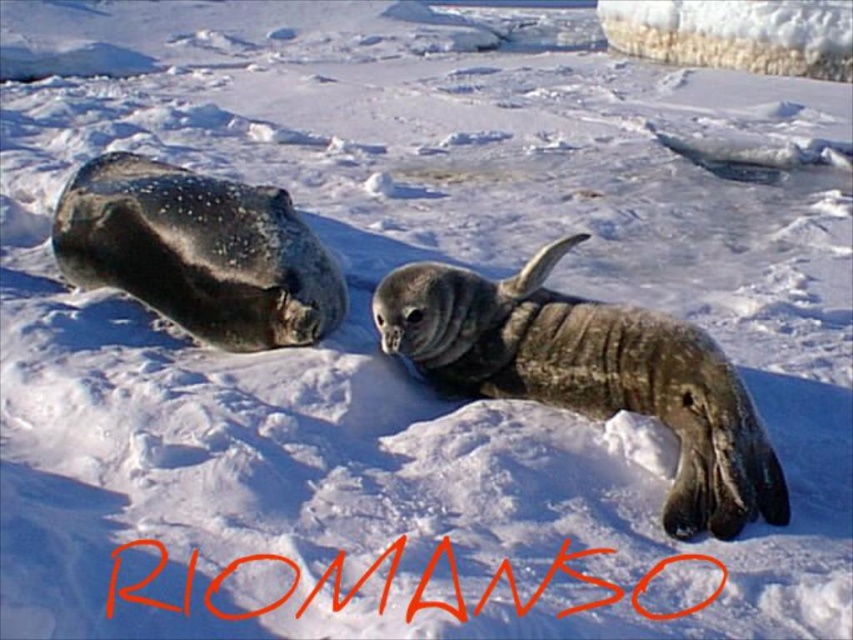
Can you confirm if grayish-brown fur seal at center is smaller than speckled fur seal at left?

Yes, grayish-brown fur seal at center is smaller than speckled fur seal at left.

Where is `grayish-brown fur seal at center`? grayish-brown fur seal at center is located at coordinates (590, 376).

Locate an element on the screen. This screenshot has height=640, width=853. grayish-brown fur seal at center is located at coordinates (590, 376).